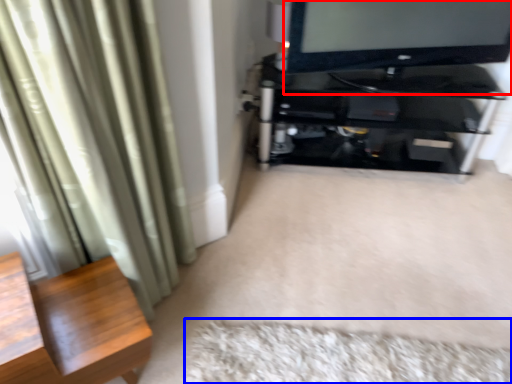
Question: Which of the following is the closest to the observer, television (highlighted by a red box) or mat (highlighted by a blue box)?

Choices:
 (A) television
 (B) mat

Answer: (B)